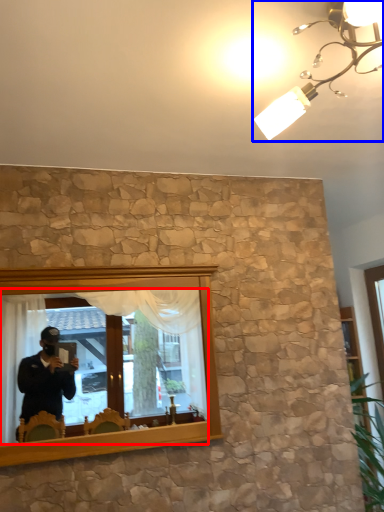
Question: Which point is closer to the camera, mirror (highlighted by a red box) or light fixture (highlighted by a blue box)?

Choices:
 (A) mirror
 (B) light fixture

Answer: (B)